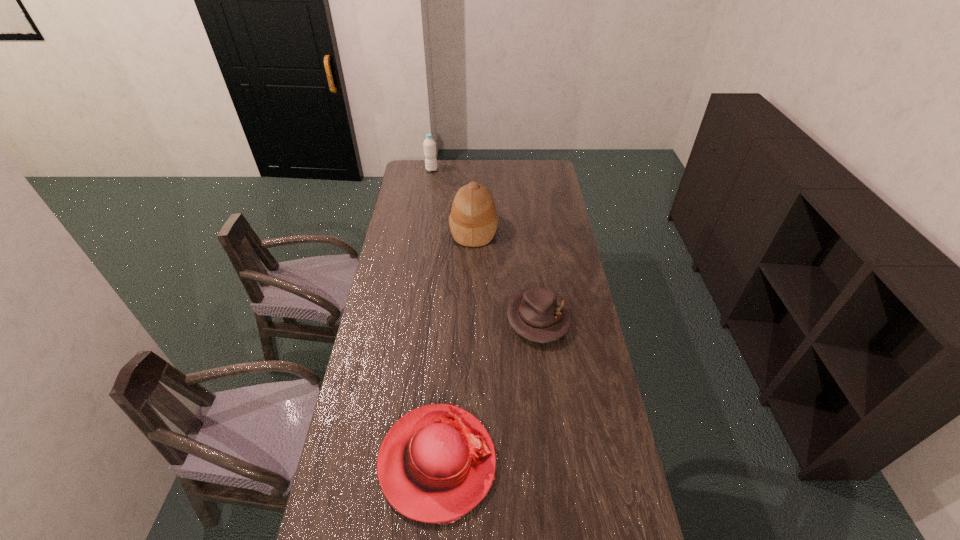
Where is `vacant space that satisfies the following two spatial constraints: 1. on the decorative side of the shortest object; 2. at the front of the nearest hat with a bow`? vacant space that satisfies the following two spatial constraints: 1. on the decorative side of the shortest object; 2. at the front of the nearest hat with a bow is located at coordinates (556, 462).

Identify the location of vacant space that satisfies the following two spatial constraints: 1. on the decorative side of the shortest hat; 2. at the front of the nearest object with a bow. The width and height of the screenshot is (960, 540). (556, 462).